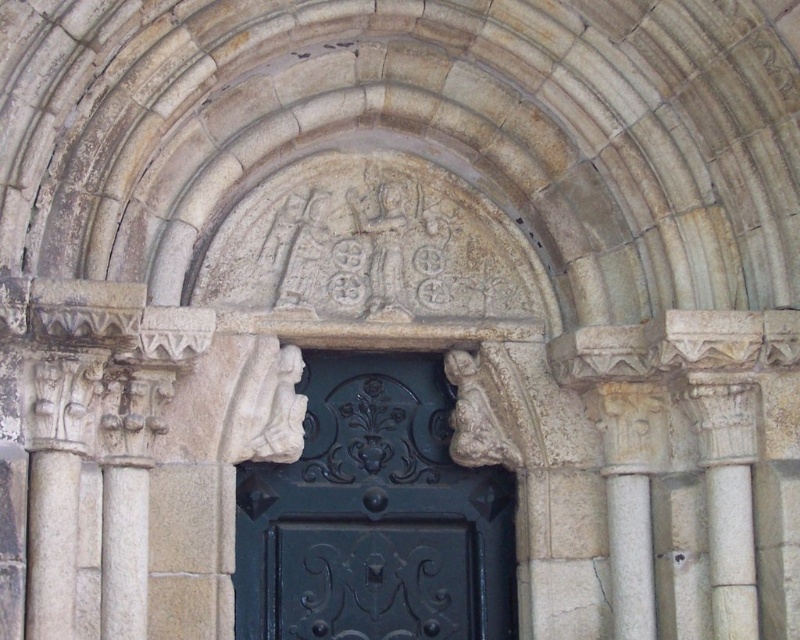
Who is taller, green polished wood door at center or white stone column at left?

With more height is green polished wood door at center.

Which is below, green polished wood door at center or white stone column at left?

white stone column at left is below.

Is point (416, 548) farther from camera compared to point (110, 467)?

That is True.

The width and height of the screenshot is (800, 640). I want to click on green polished wood door at center, so click(374, 515).